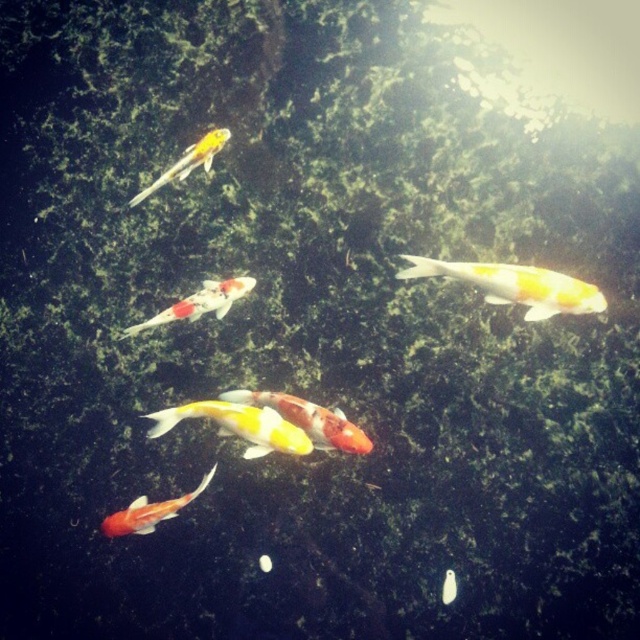
Between shiny goldfish at upper right and yellow and white koi fish at center, which one is positioned lower?

Positioned lower is yellow and white koi fish at center.

Image resolution: width=640 pixels, height=640 pixels. Describe the element at coordinates (515, 285) in the screenshot. I see `shiny goldfish at upper right` at that location.

Measure the distance between shiny goldfish at upper right and camera.

shiny goldfish at upper right is 7.28 feet from camera.

Where is `shiny goldfish at upper right`? shiny goldfish at upper right is located at coordinates coord(515,285).

This screenshot has width=640, height=640. In order to click on shiny multicolored fish at center in this screenshot , I will do `click(308, 419)`.

What do you see at coordinates (308, 419) in the screenshot? The height and width of the screenshot is (640, 640). I see `shiny multicolored fish at center` at bounding box center [308, 419].

Identify the location of shiny multicolored fish at center. The height and width of the screenshot is (640, 640). (308, 419).

Is point (220, 289) in front of point (131, 525)?

Yes, point (220, 289) is in front of point (131, 525).

Locate an element on the screen. The height and width of the screenshot is (640, 640). shiny metallic fish at center is located at coordinates (198, 304).